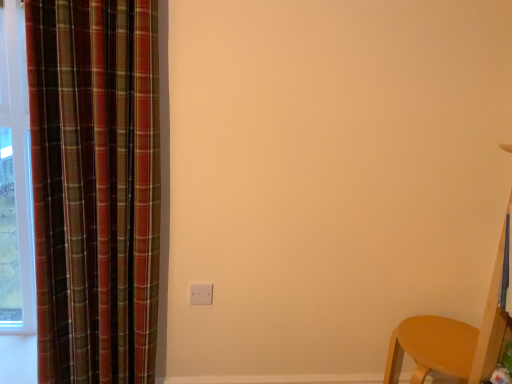
Question: From the image's perspective, relative to matte wood chair at lower right, is plaid fabric curtain at left above or below?

Choices:
 (A) above
 (B) below

Answer: (A)

Question: Would you say plaid fabric curtain at left is to the left or to the right of matte wood chair at lower right in the picture?

Choices:
 (A) right
 (B) left

Answer: (B)

Question: Which object is the closest to the matte wood chair at lower right?

Choices:
 (A) plaid fabric curtain at left
 (B) white matte electric outlet at center

Answer: (B)

Question: Estimate the real-world distances between objects in this image. Which object is closer to the matte wood chair at lower right?

Choices:
 (A) plaid fabric curtain at left
 (B) white matte electric outlet at center

Answer: (B)